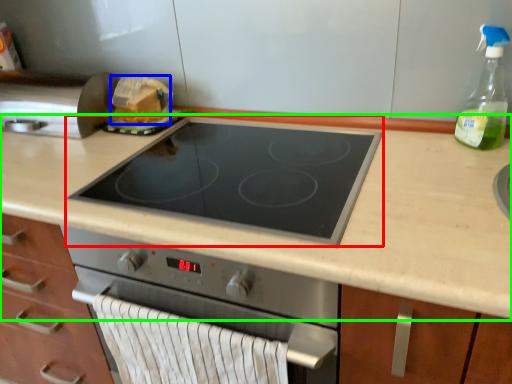
Question: Which object is the closest to the gas stove (highlighted by a red box)? Choose among these: food (highlighted by a blue box) or countertop (highlighted by a green box).

Choices:
 (A) food
 (B) countertop

Answer: (B)